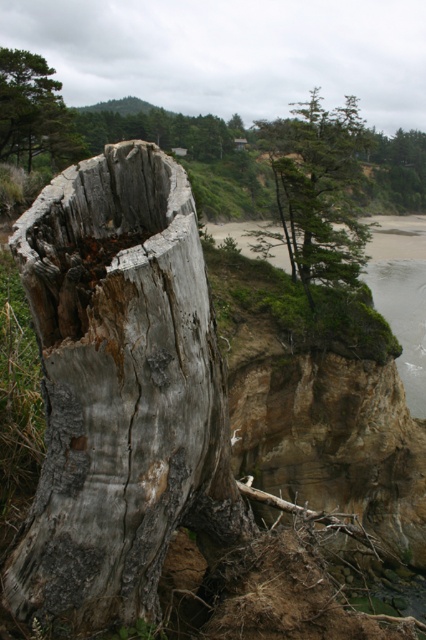
You are standing at the base of the cliff and see the green rough bark tree at upper center and the green textured pine tree at upper left. Which tree is positioned higher up in the scene?

The green rough bark tree at upper center is positioned higher up in the scene than the green textured pine tree at upper left.

You are standing at the base of the cliff to the right of the large weathered tree stump. You want to climb up to the green rough bark tree at upper center. Based on its coordinates, can you estimate how far you need to move horizontally and vertically from your current position to reach it?

The green rough bark tree at upper center is located at coordinates point (319, 188). To reach it from the base of the cliff to the right of the large weathered tree stump, you would need to move approximately 0.295 units horizontally to the left and 0.749 units vertically upwards.

You are standing at the edge of the cliff and want to take a photo of the coastal landscape. There are two points marked in the image, point 1 at coordinates point (48,246) and point 2 at coordinates point (3,84). Which point should you focus on to ensure the foreground tree stump is in sharp focus?

You should focus on point (48,246) because it is closer to the camera than point (3,84), ensuring the foreground tree stump is in sharp focus.